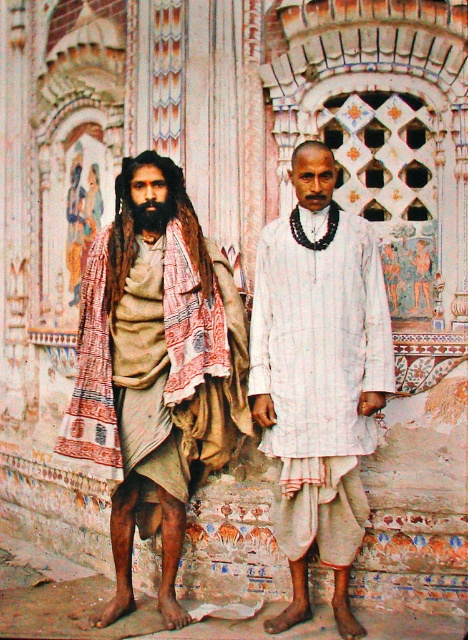
Question: Does beige fabric draped at left appear over black fuzzy beard at left?

Choices:
 (A) no
 (B) yes

Answer: (A)

Question: Which object is closer to the camera taking this photo?

Choices:
 (A) black fuzzy beard at left
 (B) white striped shirt at center

Answer: (B)

Question: Can you confirm if beige fabric draped at left is positioned below black fuzzy beard at left?

Choices:
 (A) yes
 (B) no

Answer: (A)

Question: Which point is closer to the camera?

Choices:
 (A) (155, 220)
 (B) (323, 397)
 (C) (204, 346)

Answer: (B)

Question: Can you confirm if white striped shirt at center is smaller than black fuzzy beard at left?

Choices:
 (A) no
 (B) yes

Answer: (A)

Question: Which object appears farthest from the camera in this image?

Choices:
 (A) white striped shirt at center
 (B) black fuzzy beard at left

Answer: (B)